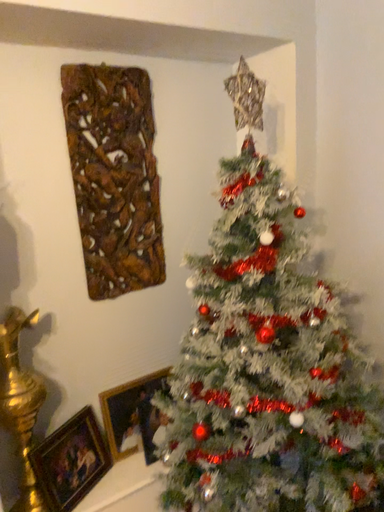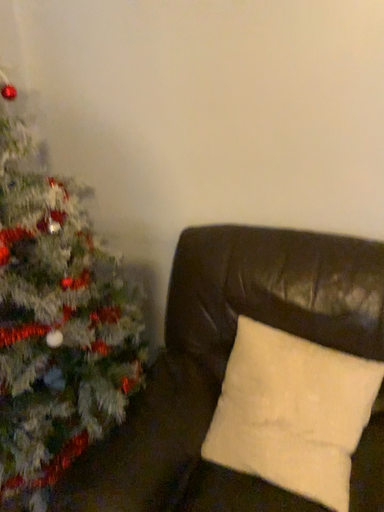
Question: Which way did the camera rotate in the video?

Choices:
 (A) rotated left
 (B) rotated right

Answer: (B)